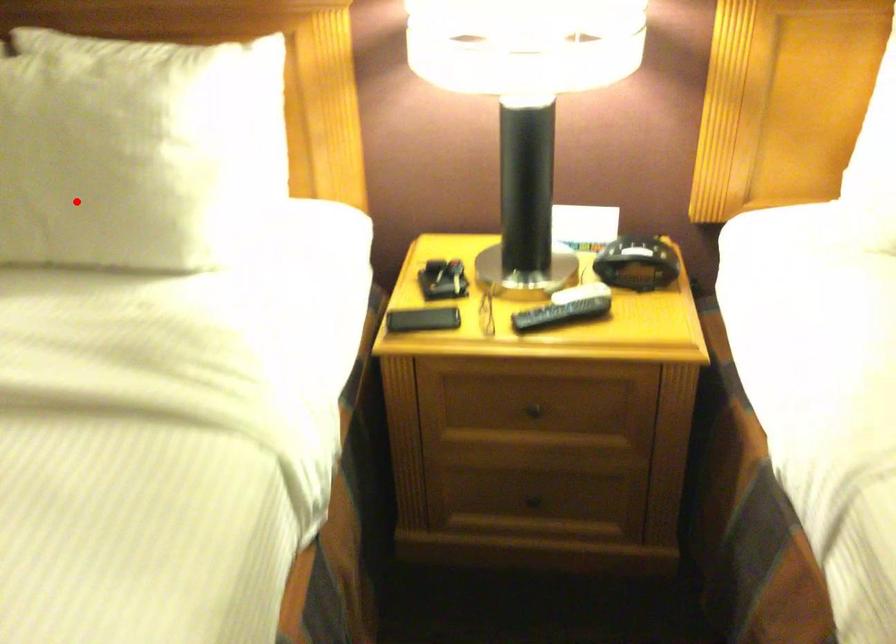
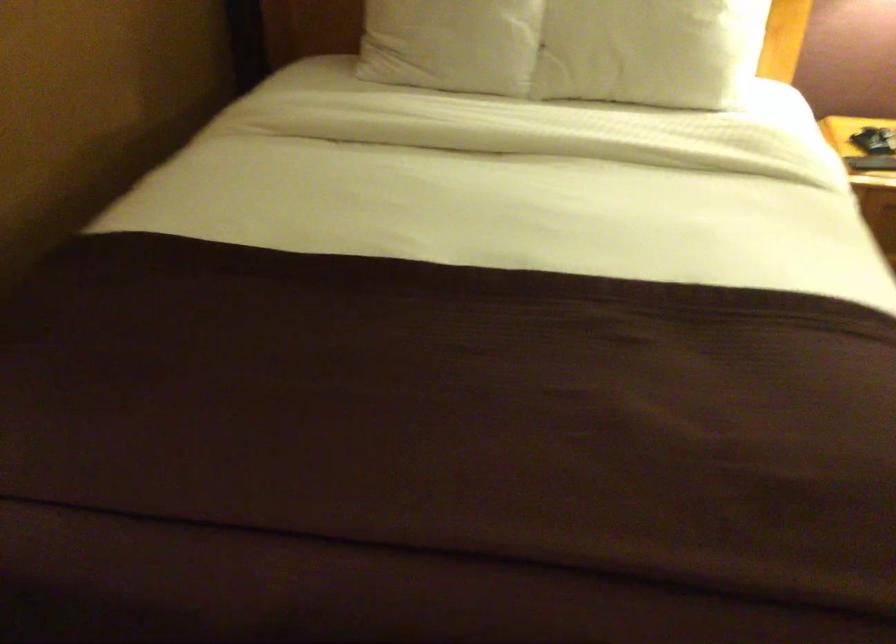
The point at the highlighted location is marked in the first image. Where is the corresponding point in the second image?

(649, 51)